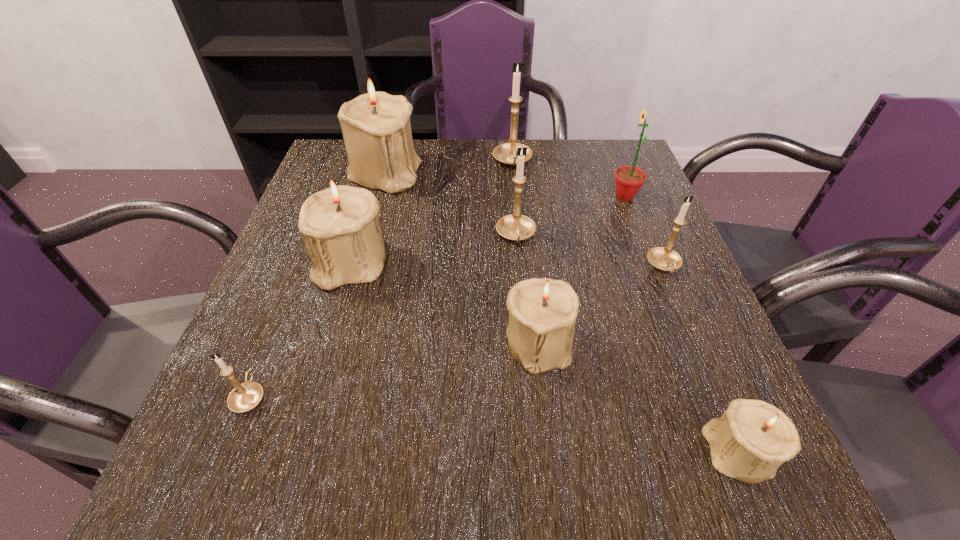
Where is `the farthest gold candle holder`? the farthest gold candle holder is located at coordinates (505, 153).

I want to click on the biggest beige candle_holder, so click(x=376, y=128).

In order to click on sunflower in this screenshot , I will do `click(629, 179)`.

Find the location of a particular element. This screenshot has width=960, height=540. the third smallest gold candle holder is located at coordinates (516, 227).

This screenshot has width=960, height=540. Identify the location of the second biggest beige candle_holder. [x=340, y=227].

At what (x,y) coordinates should I click in order to perform the action: click on the rightmost gold candle holder. Please return your answer as a coordinate pair (x, y). Image resolution: width=960 pixels, height=540 pixels. Looking at the image, I should click on (663, 258).

At what (x,y) coordinates should I click in order to perform the action: click on the second nearest beige candle_holder. Please return your answer as a coordinate pair (x, y). Looking at the image, I should click on (542, 311).

The width and height of the screenshot is (960, 540). I want to click on the third nearest candle_holder, so click(x=542, y=311).

Find the location of a particular element. the leftmost gold candle holder is located at coordinates (244, 397).

Locate an element on the screen. The height and width of the screenshot is (540, 960). the eighth farthest object is located at coordinates (244, 397).